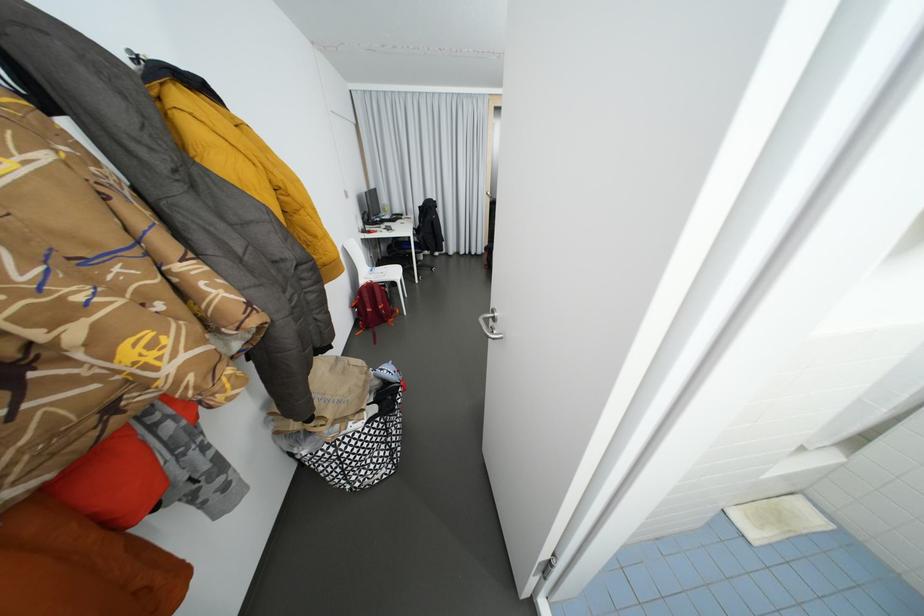
Image resolution: width=924 pixels, height=616 pixels. Describe the element at coordinates (490, 325) in the screenshot. I see `the silver door handle` at that location.